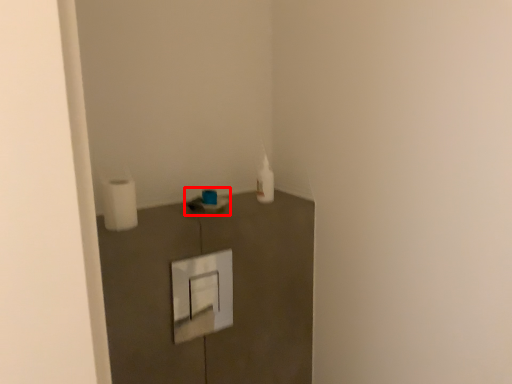
Question: From the image's perspective, where is sink (annotated by the red box) located in relation to toilet paper in the image?

Choices:
 (A) below
 (B) above

Answer: (A)